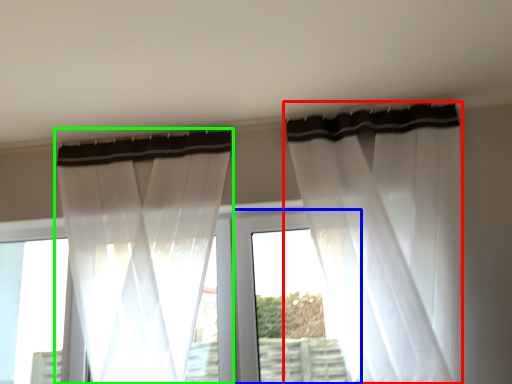
Question: Which object is the farthest from curtain (highlighted by a red box)? Choose among these: window frame (highlighted by a blue box) or curtain (highlighted by a green box).

Choices:
 (A) window frame
 (B) curtain

Answer: (B)